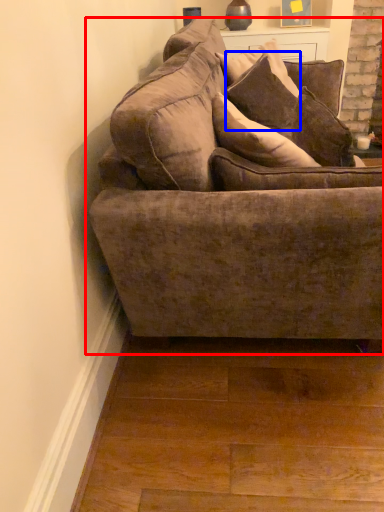
Question: Among these objects, which one is farthest to the camera, studio couch (highlighted by a red box) or pillow (highlighted by a blue box)?

Choices:
 (A) studio couch
 (B) pillow

Answer: (B)